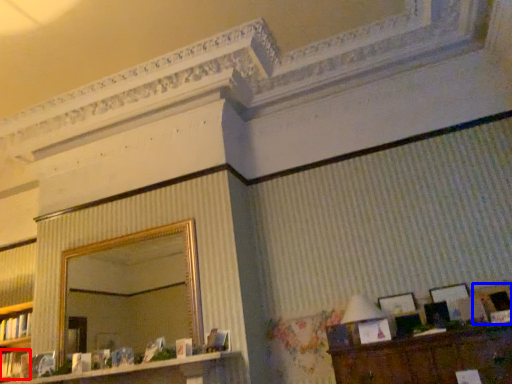
Question: Which of the following is the farthest to the observer, book (highlighted by a red box) or picture frame (highlighted by a blue box)?

Choices:
 (A) book
 (B) picture frame

Answer: (A)